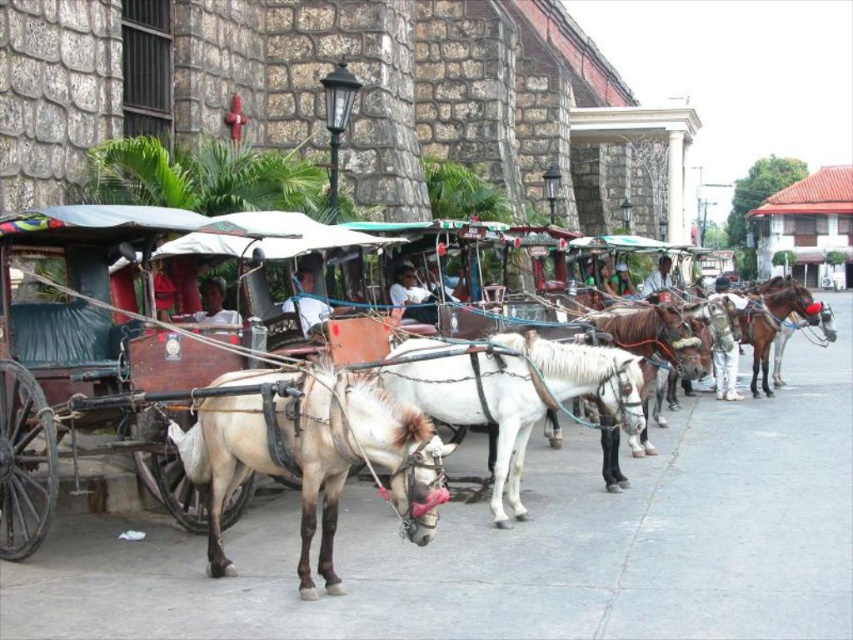
You are a photographer standing at the point with coordinates (724, 371) in the image. What object is directly under your feet?

The point at (724, 371) is on the camouflage patterned jacket at center, so the camouflage patterned jacket at center is directly under your feet.

You are a photographer standing in front of the carriages. You notice the light blue fabric at center and the light brown skin at center. Which object is located to the right when viewed from your perspective?

The light blue fabric at center is positioned on the right side of light brown skin at center, so it is located to the right.